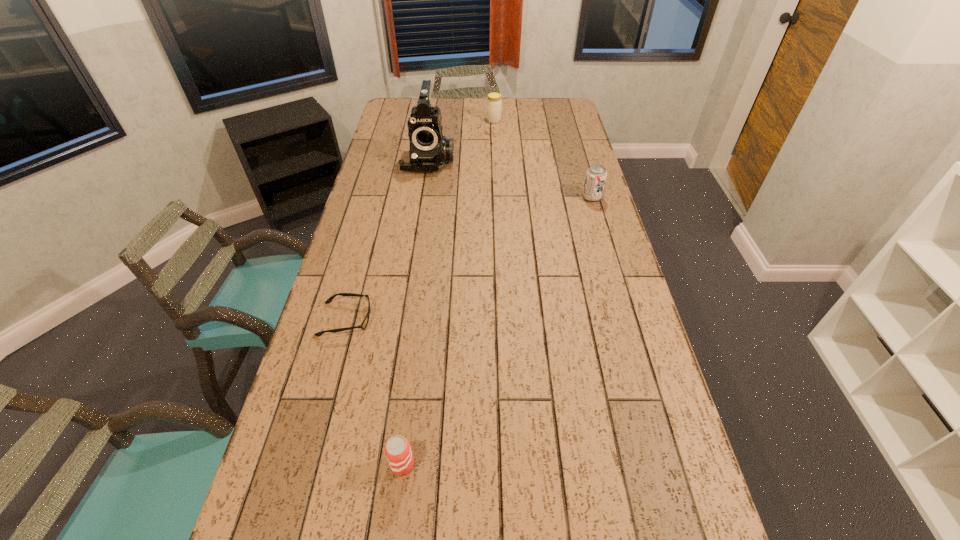
You are a GUI agent. You are given a task and a screenshot of the screen. Output one action in this format:
    pyautogui.click(x=<x>, y=<y>)
    Task: Click on the tallest object
    The image size is (960, 540).
    Given the screenshot: What is the action you would take?
    429,150

Identify the location of camcorder. (429, 150).

At what (x,y) coordinates should I click in order to perform the action: click on the third nearest object. Please return your answer as a coordinate pair (x, y). The width and height of the screenshot is (960, 540). Looking at the image, I should click on (596, 175).

You are a GUI agent. You are given a task and a screenshot of the screen. Output one action in this format:
    pyautogui.click(x=<x>, y=<y>)
    Task: Click on the rightmost object
    
    Given the screenshot: What is the action you would take?
    pyautogui.click(x=596, y=175)

I want to click on jar, so click(x=494, y=103).

Where is `the second object from right to left`? The width and height of the screenshot is (960, 540). the second object from right to left is located at coordinates (494, 103).

Locate an element on the screen. This screenshot has height=540, width=960. the nearest object is located at coordinates (398, 451).

Find the location of `the nearer beer can`. the nearer beer can is located at coordinates (398, 451).

The image size is (960, 540). In order to click on the second nearest object in this screenshot , I will do `click(364, 324)`.

Where is `spectacles`? spectacles is located at coordinates (364, 324).